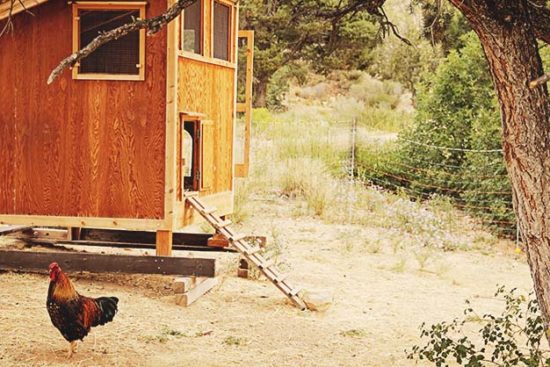
I want to click on ladder, so click(x=252, y=260).